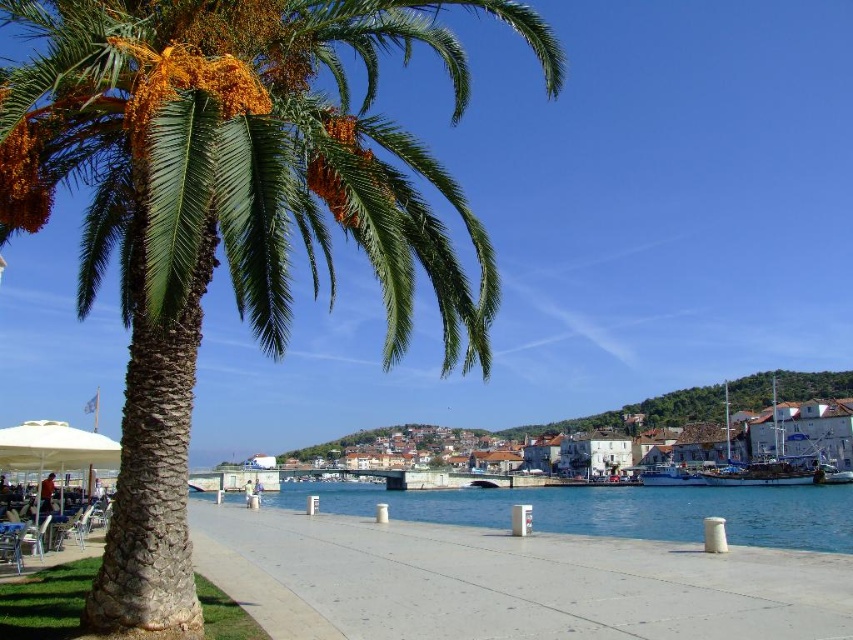
In the scene shown: Can you confirm if concrete at center is positioned to the right of white fabric umbrella at lower left?

Correct, you'll find concrete at center to the right of white fabric umbrella at lower left.

Does concrete at center have a greater height compared to white fabric umbrella at lower left?

Indeed, concrete at center has a greater height compared to white fabric umbrella at lower left.

Between point (308, 547) and point (20, 426), which one is positioned in front?

Positioned in front is point (308, 547).

Locate an element on the screen. concrete at center is located at coordinates (511, 580).

Does green leafy palm tree at left appear on the left side of white stone buildings at center?

Correct, you'll find green leafy palm tree at left to the left of white stone buildings at center.

Between green leafy palm tree at left and white stone buildings at center, which one has more height?

Standing taller between the two is white stone buildings at center.

Describe the element at coordinates (227, 211) in the screenshot. The height and width of the screenshot is (640, 853). I see `green leafy palm tree at left` at that location.

Identify the location of green leafy palm tree at left. (227, 211).

Does concrete at center appear on the left side of white stone buildings at center?

Indeed, concrete at center is positioned on the left side of white stone buildings at center.

Is concrete at center wider than white stone buildings at center?

In fact, concrete at center might be narrower than white stone buildings at center.

This screenshot has height=640, width=853. Describe the element at coordinates (511, 580) in the screenshot. I see `concrete at center` at that location.

Where is `concrete at center`? This screenshot has height=640, width=853. concrete at center is located at coordinates (511, 580).